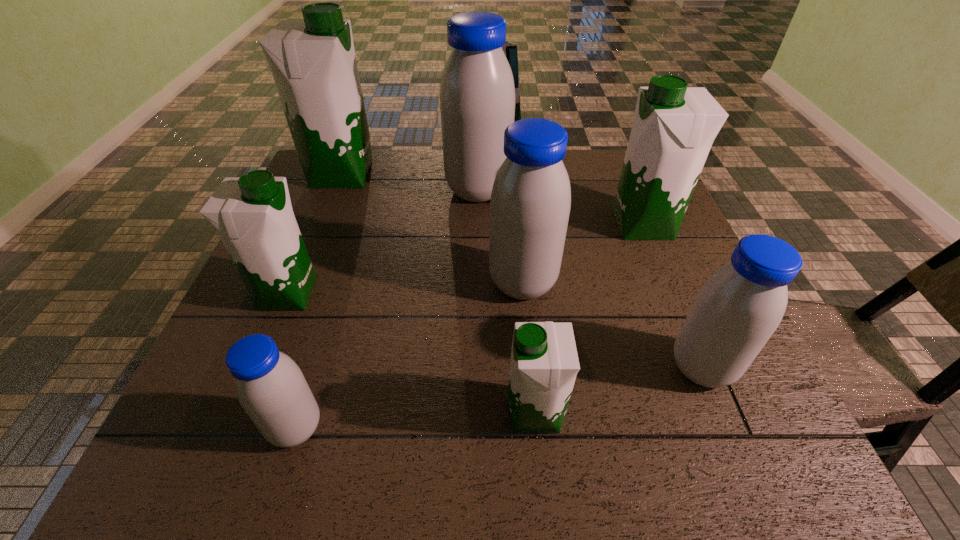
At what (x,y) coordinates should I click in order to perform the action: click on vacant area situated on the front-facing side of the nearest green soya milk. Please return your answer as a coordinate pair (x, y). Image resolution: width=960 pixels, height=540 pixels. Looking at the image, I should click on (444, 413).

Where is `free space located on the front-facing side of the nearest green soya milk`? free space located on the front-facing side of the nearest green soya milk is located at coordinates (366, 413).

Image resolution: width=960 pixels, height=540 pixels. Identify the location of vacant space situated on the front-facing side of the nearest green soya milk. (299, 413).

Locate an element on the screen. The width and height of the screenshot is (960, 540). free location located 0.140m on the left of the smallest blue soya milk is located at coordinates (188, 428).

Locate an element on the screen. This screenshot has width=960, height=540. object located at the far left corner is located at coordinates (313, 63).

Find the location of a particular element. This screenshot has width=960, height=540. object located at the near left corner is located at coordinates (271, 388).

Locate an element on the screen. The width and height of the screenshot is (960, 540). free space at the far edge is located at coordinates (590, 165).

The width and height of the screenshot is (960, 540). In the image, there is a desktop. What are the coordinates of `blank space at the near edge` in the screenshot? It's located at (365, 433).

The width and height of the screenshot is (960, 540). Identify the location of vacant region at the left edge. (326, 267).

Find the location of a particular element. free location at the right edge of the desktop is located at coordinates (637, 266).